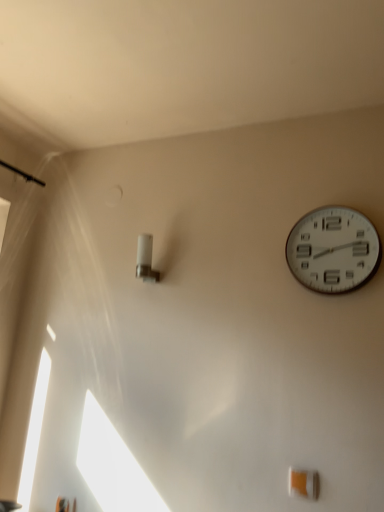
The image size is (384, 512). Describe the element at coordinates (145, 259) in the screenshot. I see `white plastic light fixture at center-left` at that location.

Locate an element on the screen. white plastic light fixture at center-left is located at coordinates coord(145,259).

Measure the distance between point (298, 268) and camera.

They are 4.70 feet apart.

What do you see at coordinates (333, 250) in the screenshot? The height and width of the screenshot is (512, 384). I see `white plastic wall clock at upper right` at bounding box center [333, 250].

The height and width of the screenshot is (512, 384). Find the location of `white plastic wall clock at upper right`. white plastic wall clock at upper right is located at coordinates (333, 250).

Identify the location of white plastic light fixture at center-left. The image size is (384, 512). (145, 259).

Is white plastic light fixture at center-left at the right side of white plastic wall clock at upper right?

Incorrect, white plastic light fixture at center-left is not on the right side of white plastic wall clock at upper right.

Is white plastic light fixture at center-left closer to the viewer compared to white plastic wall clock at upper right?

That is False.

Does point (148, 269) lie behind point (365, 218)?

Yes, point (148, 269) is farther from viewer.

From the image's perspective, which is below, white plastic light fixture at center-left or white plastic wall clock at upper right?

From the image's view, white plastic light fixture at center-left is below.

From a real-world perspective, which is physically above, white plastic light fixture at center-left or white plastic wall clock at upper right?

white plastic wall clock at upper right, from a real-world perspective.

Is white plastic light fixture at center-left wider than white plastic wall clock at upper right?

Yes.

Considering the sizes of objects white plastic light fixture at center-left and white plastic wall clock at upper right in the image provided, who is taller, white plastic light fixture at center-left or white plastic wall clock at upper right?

white plastic wall clock at upper right.

Does white plastic light fixture at center-left have a smaller size compared to white plastic wall clock at upper right?

Yes, white plastic light fixture at center-left is smaller than white plastic wall clock at upper right.

Is white plastic wall clock at upper right surrounded by white plastic light fixture at center-left?

No, white plastic light fixture at center-left does not contain white plastic wall clock at upper right.

Based on the photo, is white plastic light fixture at center-left next to white plastic wall clock at upper right and touching it?

No, white plastic light fixture at center-left is not beside white plastic wall clock at upper right.

Could you tell me if white plastic light fixture at center-left is turned towards white plastic wall clock at upper right?

No, white plastic light fixture at center-left is not turned towards white plastic wall clock at upper right.

Can you tell me how much white plastic light fixture at center-left and white plastic wall clock at upper right differ in facing direction?

white plastic light fixture at center-left and white plastic wall clock at upper right are facing 0.00224 degrees away from each other.

In order to click on wall clock on the right of the white plastic light fixture at center-left in this screenshot , I will do `click(333, 250)`.

Is white plastic wall clock at upper right to the left or to the right of white plastic light fixture at center-left in the image?

Clearly, white plastic wall clock at upper right is on the right of white plastic light fixture at center-left in the image.

Which object is more forward, white plastic wall clock at upper right or white plastic light fixture at center-left?

white plastic wall clock at upper right is in front.

Is point (355, 281) positioned after point (149, 243)?

No, (355, 281) is in front of (149, 243).

From the image's perspective, is white plastic wall clock at upper right over white plastic light fixture at center-left?

Correct, white plastic wall clock at upper right appears higher than white plastic light fixture at center-left in the image.

From a real-world perspective, does white plastic wall clock at upper right sit lower than white plastic light fixture at center-left?

No, from a real-world perspective, white plastic wall clock at upper right is not under white plastic light fixture at center-left.

From the picture: Does white plastic wall clock at upper right have a lesser width compared to white plastic light fixture at center-left?

Yes, white plastic wall clock at upper right is thinner than white plastic light fixture at center-left.

Who is shorter, white plastic wall clock at upper right or white plastic light fixture at center-left?

white plastic light fixture at center-left.

Looking at the image, does white plastic wall clock at upper right seem bigger or smaller compared to white plastic light fixture at center-left?

white plastic wall clock at upper right is bigger than white plastic light fixture at center-left.

Is white plastic light fixture at center-left inside white plastic wall clock at upper right?

No, white plastic light fixture at center-left is not surrounded by white plastic wall clock at upper right.

Is white plastic wall clock at upper right next to white plastic light fixture at center-left and touching it?

No.

Is white plastic wall clock at upper right aimed at white plastic light fixture at center-left?

No, white plastic wall clock at upper right is not aimed at white plastic light fixture at center-left.

From the picture: Can you tell me how much white plastic wall clock at upper right and white plastic light fixture at center-left differ in facing direction?

They differ by 0.00224 degrees in their facing directions.

Measure the distance between white plastic wall clock at upper right and white plastic light fixture at center-left.

white plastic wall clock at upper right and white plastic light fixture at center-left are 25.84 inches apart.

Locate an element on the screen. Image resolution: width=384 pixels, height=512 pixels. light fixture that appears below the white plastic wall clock at upper right (from the image's perspective) is located at coordinates (145, 259).

Find the location of a particular element. wall clock that appears above the white plastic light fixture at center-left (from the image's perspective) is located at coordinates (333, 250).

Locate an element on the screen. Image resolution: width=384 pixels, height=512 pixels. wall clock in front of the white plastic light fixture at center-left is located at coordinates (333, 250).